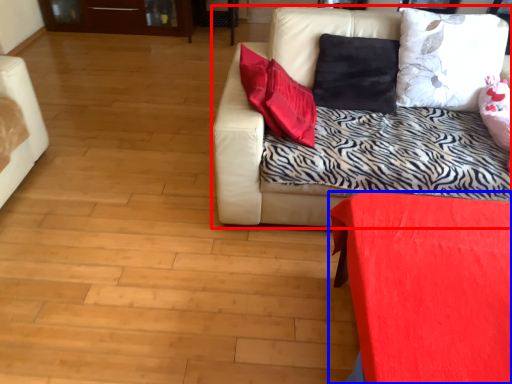
Question: Which object is closer to the camera taking this photo, studio couch (highlighted by a red box) or furniture (highlighted by a blue box)?

Choices:
 (A) studio couch
 (B) furniture

Answer: (B)